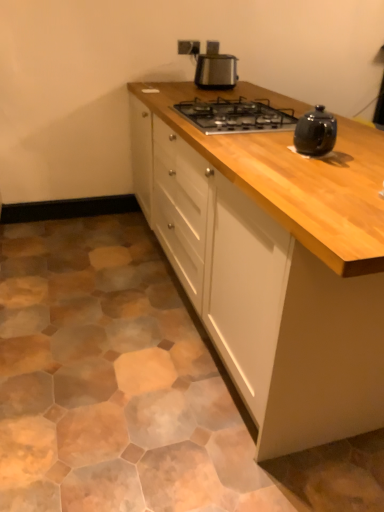
What are the coordinates of `space that is in front of satin metallic toaster at upper center` in the screenshot? It's located at (222, 90).